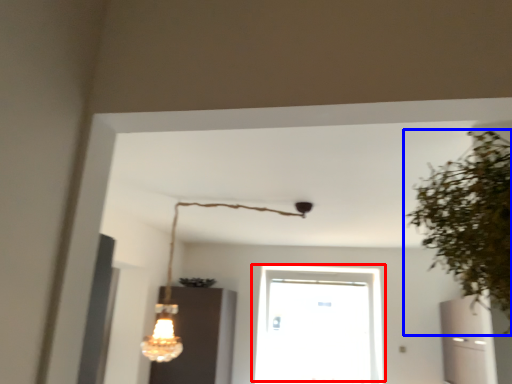
Question: Which of the following is the farthest to the observer, window (highlighted by a red box) or houseplant (highlighted by a blue box)?

Choices:
 (A) window
 (B) houseplant

Answer: (A)